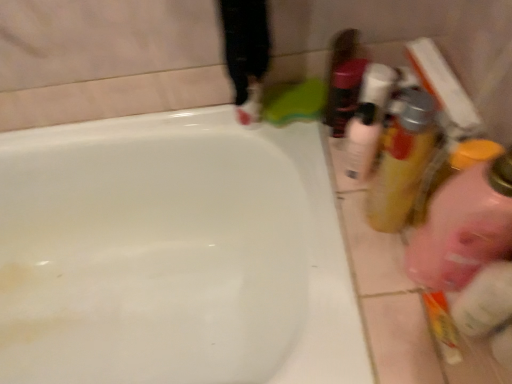
Find the location of a particular element. This screenshot has width=512, height=384. pink translucent bottle at right is located at coordinates (464, 227).

In order to face pink translucent bottle at right, should I rotate leftwards or rightwards?

Rotate your view right by about 25.892°.

This screenshot has height=384, width=512. What do you see at coordinates (402, 161) in the screenshot?
I see `translucent plastic mouthwash at right, which ranks as the second mouthwash in left-to-right order` at bounding box center [402, 161].

What do you see at coordinates (344, 94) in the screenshot? This screenshot has width=512, height=384. I see `translucent plastic bottle at upper right` at bounding box center [344, 94].

You are a GUI agent. You are given a task and a screenshot of the screen. Output one action in this format:
    pyautogui.click(x=<x>, y=<y>)
    Task: Click on the pink translucent bottle at right
    The image size is (512, 384).
    Given the screenshot: What is the action you would take?
    pyautogui.click(x=464, y=227)

Who is taller, translucent plastic bottle at upper right or translucent plastic mouthwash at right, the 1th mouthwash when ordered from right to left?

translucent plastic mouthwash at right, the 1th mouthwash when ordered from right to left, is taller.

Would you say translucent plastic bottle at upper right is a long distance from translucent plastic mouthwash at right, which ranks as the second mouthwash in left-to-right order?

No, translucent plastic bottle at upper right is not far away from translucent plastic mouthwash at right, which ranks as the second mouthwash in left-to-right order.

Does translucent plastic bottle at upper right have a larger size compared to translucent plastic mouthwash at right, the 1th mouthwash when ordered from right to left?

Incorrect, translucent plastic bottle at upper right is not larger than translucent plastic mouthwash at right, the 1th mouthwash when ordered from right to left.

Is translucent plastic bottle at upper right to the left of white glossy mouthwash at upper right, which ranks as the 2th mouthwash in right-to-left order, from the viewer's perspective?

Yes, translucent plastic bottle at upper right is to the left of white glossy mouthwash at upper right, which ranks as the 2th mouthwash in right-to-left order.

Is translucent plastic bottle at upper right with white glossy mouthwash at upper right, positioned as the first mouthwash in left-to-right order?

Yes, translucent plastic bottle at upper right is in contact with white glossy mouthwash at upper right, positioned as the first mouthwash in left-to-right order.

From a real-world perspective, relative to white glossy mouthwash at upper right, which ranks as the 2th mouthwash in right-to-left order, is translucent plastic bottle at upper right vertically above or below?

Clearly, from a real-world perspective, translucent plastic bottle at upper right is above white glossy mouthwash at upper right, which ranks as the 2th mouthwash in right-to-left order.

Is white glossy mouthwash at upper right, positioned as the first mouthwash in left-to-right order, taller than translucent plastic bottle at upper right?

Incorrect, the height of white glossy mouthwash at upper right, positioned as the first mouthwash in left-to-right order, is not larger of that of translucent plastic bottle at upper right.

Can we say white glossy mouthwash at upper right, positioned as the first mouthwash in left-to-right order, lies outside translucent plastic bottle at upper right?

That's correct, white glossy mouthwash at upper right, positioned as the first mouthwash in left-to-right order, is outside of translucent plastic bottle at upper right.

From the image's perspective, between white glossy mouthwash at upper right, which ranks as the 2th mouthwash in right-to-left order, and translucent plastic bottle at upper right, who is located below?

white glossy mouthwash at upper right, which ranks as the 2th mouthwash in right-to-left order, appears lower in the image.

Is white glossy mouthwash at upper right, which ranks as the 2th mouthwash in right-to-left order, turned away from translucent plastic bottle at upper right?

No, white glossy mouthwash at upper right, which ranks as the 2th mouthwash in right-to-left order, is not facing away from translucent plastic bottle at upper right.

Is pink translucent bottle at right positioned beyond the bounds of translucent plastic bottle at upper right?

Yes, pink translucent bottle at right is outside of translucent plastic bottle at upper right.

Considering the points (456, 285) and (351, 112), which point is behind, point (456, 285) or point (351, 112)?

The point (351, 112) is farther from the camera.

Is pink translucent bottle at right aimed at translucent plastic bottle at upper right?

No, pink translucent bottle at right is not facing towards translucent plastic bottle at upper right.

In the scene shown: Is translucent plastic bottle at upper right taller than pink translucent bottle at right?

In fact, translucent plastic bottle at upper right may be shorter than pink translucent bottle at right.

Is pink translucent bottle at right inside translucent plastic bottle at upper right?

No.

Would you say translucent plastic bottle at upper right is a long distance from pink translucent bottle at right?

No, translucent plastic bottle at upper right is not far from pink translucent bottle at right.

Who is more distant, translucent plastic bottle at upper right or pink translucent bottle at right?

translucent plastic bottle at upper right is further away from the camera.

From a real-world perspective, is translucent plastic mouthwash at right, the 1th mouthwash when ordered from right to left, above or below white glossy mouthwash at upper right, which ranks as the 2th mouthwash in right-to-left order?

In terms of real-world spatial position, translucent plastic mouthwash at right, the 1th mouthwash when ordered from right to left, is above white glossy mouthwash at upper right, which ranks as the 2th mouthwash in right-to-left order.

Is translucent plastic mouthwash at right, the 1th mouthwash when ordered from right to left, taller or shorter than white glossy mouthwash at upper right, positioned as the first mouthwash in left-to-right order?

Considering their sizes, translucent plastic mouthwash at right, the 1th mouthwash when ordered from right to left, has more height than white glossy mouthwash at upper right, positioned as the first mouthwash in left-to-right order.

From the image's perspective, is translucent plastic mouthwash at right, which ranks as the second mouthwash in left-to-right order, above white glossy mouthwash at upper right, which ranks as the 2th mouthwash in right-to-left order?

No.

Looking at this image, does white glossy mouthwash at upper right, which ranks as the 2th mouthwash in right-to-left order, have a smaller size compared to white glossy bathtub at upper center?

Yes.

Which of these two, white glossy mouthwash at upper right, which ranks as the 2th mouthwash in right-to-left order, or white glossy bathtub at upper center, is wider?

white glossy bathtub at upper center is wider.

Between white glossy mouthwash at upper right, which ranks as the 2th mouthwash in right-to-left order, and white glossy bathtub at upper center, which one appears on the left side from the viewer's perspective?

white glossy bathtub at upper center.

From the image's perspective, would you say white glossy mouthwash at upper right, positioned as the first mouthwash in left-to-right order, is shown under white glossy bathtub at upper center?

Actually, white glossy mouthwash at upper right, positioned as the first mouthwash in left-to-right order, appears above white glossy bathtub at upper center in the image.

From the image's perspective, starting from the translucent plastic bottle at upper right, which mouthwash is the 2nd one below? Please provide its 2D coordinates.

[(402, 161)]

Find the location of a particular element. Image resolution: width=512 pixels, height=384 pixels. toiletry behind the white glossy mouthwash at upper right, positioned as the first mouthwash in left-to-right order is located at coordinates (344, 94).

When comparing their distances from white glossy mouthwash at upper right, which ranks as the 2th mouthwash in right-to-left order, does white glossy bathtub at upper center or translucent plastic mouthwash at right, which ranks as the second mouthwash in left-to-right order, seem closer?

translucent plastic mouthwash at right, which ranks as the second mouthwash in left-to-right order.

Which object lies nearer to the anchor point translucent plastic bottle at upper right, white glossy bathtub at upper center or white glossy mouthwash at upper right, which ranks as the 2th mouthwash in right-to-left order?

white glossy mouthwash at upper right, which ranks as the 2th mouthwash in right-to-left order, is positioned closer to the anchor translucent plastic bottle at upper right.

From the image, which object appears to be farther from translucent plastic bottle at upper right, white glossy mouthwash at upper right, which ranks as the 2th mouthwash in right-to-left order, or pink translucent bottle at right?

pink translucent bottle at right is further to translucent plastic bottle at upper right.

Considering their positions, is pink translucent bottle at right positioned closer to white glossy bathtub at upper center than translucent plastic mouthwash at right, which ranks as the second mouthwash in left-to-right order?

Based on the image, translucent plastic mouthwash at right, which ranks as the second mouthwash in left-to-right order, appears to be nearer to white glossy bathtub at upper center.

Looking at the image, which one is located closer to white glossy mouthwash at upper right, which ranks as the 2th mouthwash in right-to-left order, pink translucent bottle at right or white glossy bathtub at upper center?

pink translucent bottle at right is positioned closer to the anchor white glossy mouthwash at upper right, which ranks as the 2th mouthwash in right-to-left order.

When comparing their distances from translucent plastic mouthwash at right, the 1th mouthwash when ordered from right to left, does white glossy mouthwash at upper right, positioned as the first mouthwash in left-to-right order, or white glossy bathtub at upper center seem further?

The object further to translucent plastic mouthwash at right, the 1th mouthwash when ordered from right to left, is white glossy bathtub at upper center.

When comparing their distances from translucent plastic mouthwash at right, the 1th mouthwash when ordered from right to left, does white glossy bathtub at upper center or translucent plastic bottle at upper right seem closer?

translucent plastic bottle at upper right is positioned closer to the anchor translucent plastic mouthwash at right, the 1th mouthwash when ordered from right to left.

Looking at the image, which one is located further to translucent plastic bottle at upper right, translucent plastic mouthwash at right, which ranks as the second mouthwash in left-to-right order, or pink translucent bottle at right?

Based on the image, pink translucent bottle at right appears to be further to translucent plastic bottle at upper right.

The height and width of the screenshot is (384, 512). I want to click on mouthwash located between pink translucent bottle at right and white glossy mouthwash at upper right, positioned as the first mouthwash in left-to-right order, in the depth direction, so click(402, 161).

The width and height of the screenshot is (512, 384). I want to click on toiletry between white glossy bathtub at upper center and white glossy mouthwash at upper right, positioned as the first mouthwash in left-to-right order, in the horizontal direction, so click(x=344, y=94).

Locate an element on the screen. This screenshot has height=384, width=512. toiletry between white glossy bathtub at upper center and translucent plastic mouthwash at right, the 1th mouthwash when ordered from right to left, from left to right is located at coordinates (344, 94).

Locate an element on the screen. This screenshot has width=512, height=384. toiletry situated between white glossy bathtub at upper center and pink translucent bottle at right from left to right is located at coordinates (344, 94).